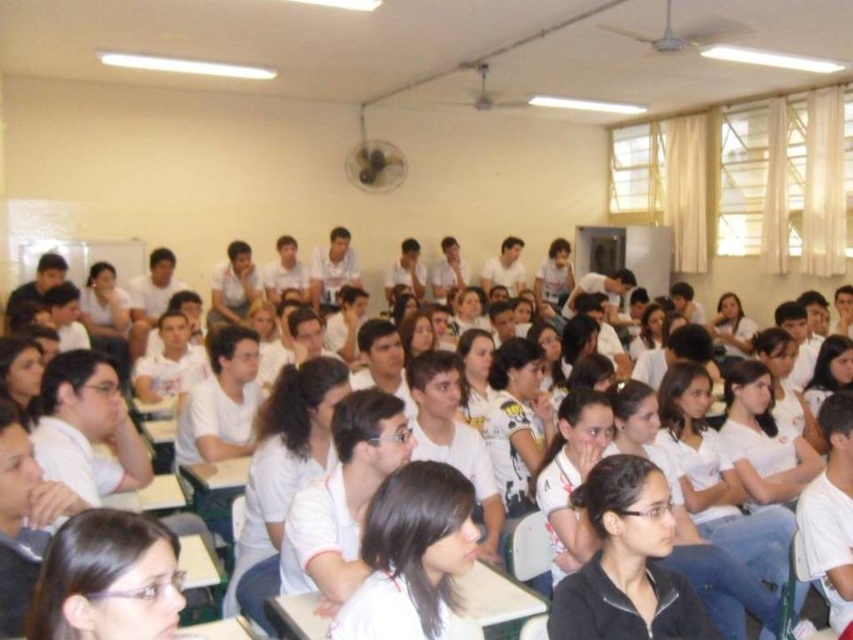
You are a photographer trying to capture a group photo of the students in the classroom. You notice two students wearing white matte shirt at center and matte white shirt at lower left. Which student should you position closer to the camera to ensure their entire shirt is visible in the photo?

You should position the white matte shirt at center closer to the camera because its width is larger than the matte white shirt at lower left, ensuring it fits within the frame better.

You are a student sitting at the desk in the back row of the classroom. You notice a point at coordinates (410,556). What object or feature does this point correspond to?

The point at coordinates (410,556) corresponds to the white matte shirt at center.